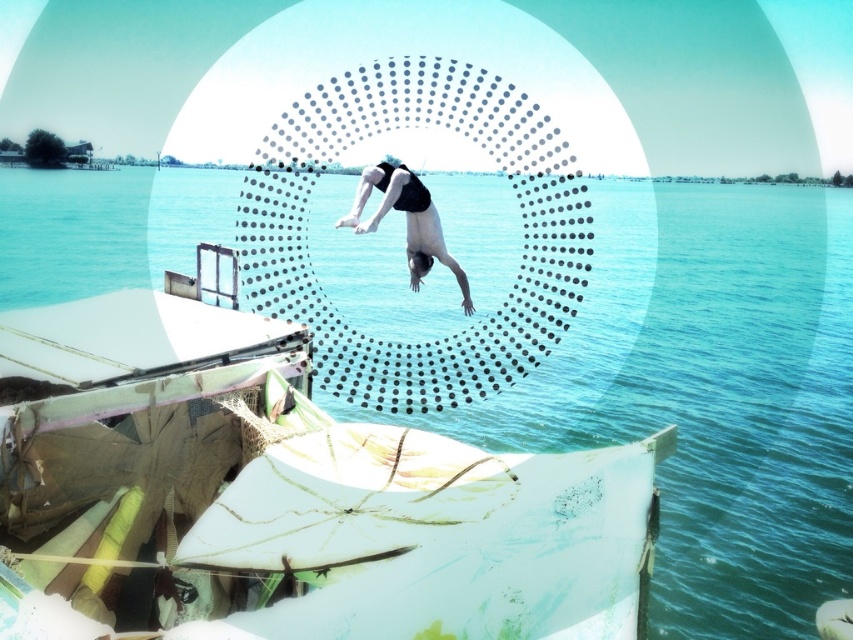
Is point (746, 275) positioned behind point (357, 228)?

That is True.

Which of these two, clear blue water at center or black matte swimsuit at center, stands taller?

clear blue water at center is taller.

Does point (763, 632) come farther from viewer compared to point (445, 246)?

No.

Image resolution: width=853 pixels, height=640 pixels. What are the coordinates of `clear blue water at center` in the screenshot? It's located at (747, 394).